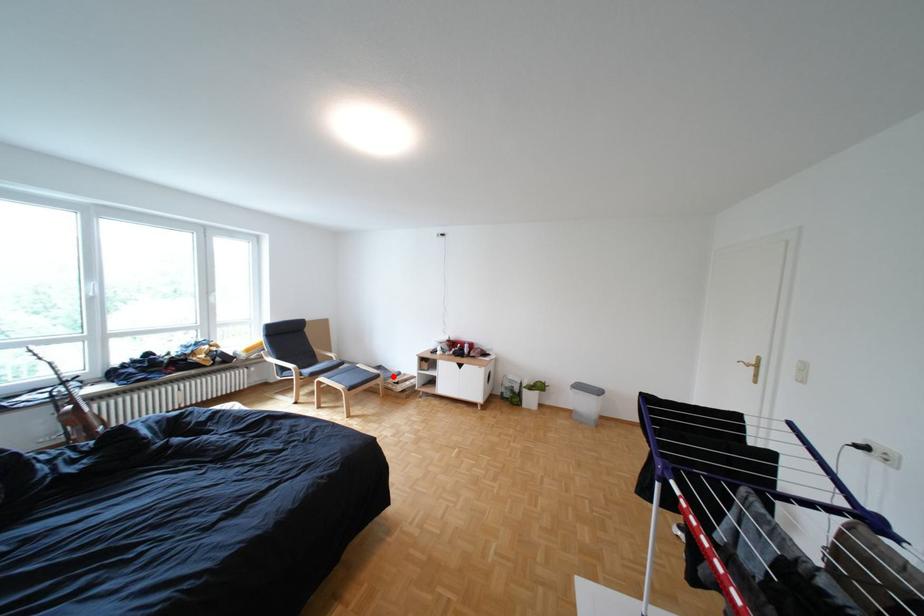
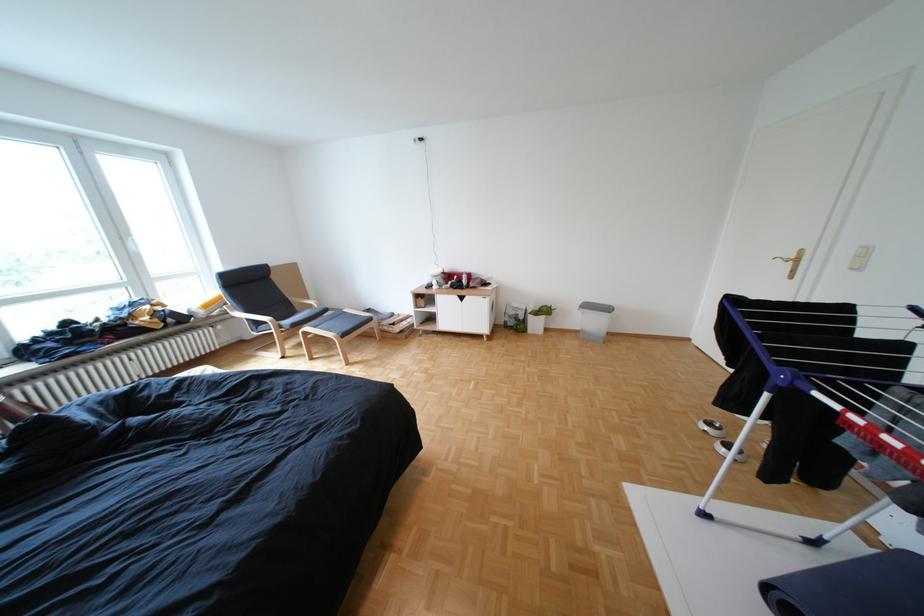
The point at the highlighted location is marked in the first image. Where is the corresponding point in the second image?

(386, 320)